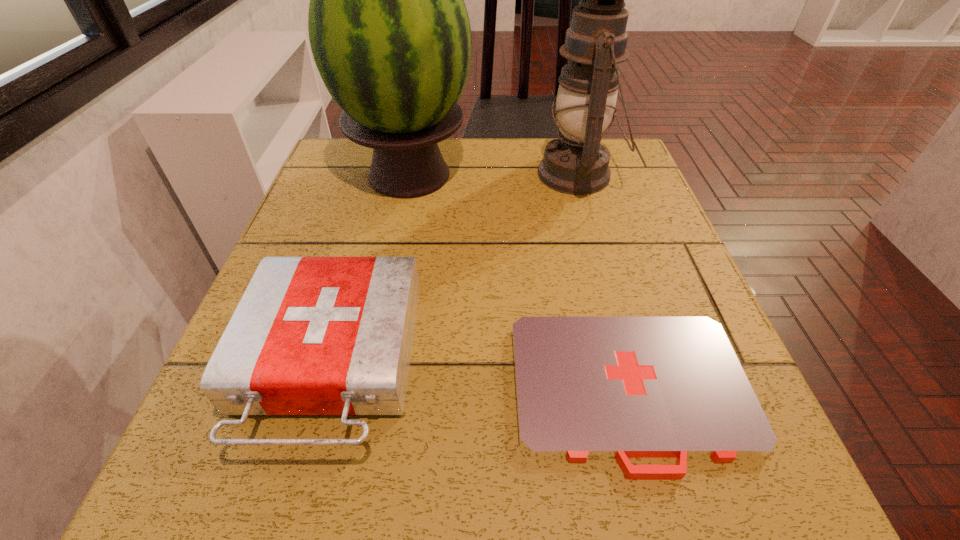
The image size is (960, 540). I want to click on watermelon that is positioned at the left edge, so click(389, 31).

Locate an element on the screen. Image resolution: width=960 pixels, height=540 pixels. the first-aid kit that is at the left edge is located at coordinates (311, 335).

At what (x,y) coordinates should I click in order to perform the action: click on oil lamp that is at the right edge. Please return your answer as a coordinate pair (x, y). The image size is (960, 540). Looking at the image, I should click on (577, 163).

Identify the location of the first-aid kit located at the right edge. The width and height of the screenshot is (960, 540). (586, 387).

Locate an element on the screen. object situated at the far left corner is located at coordinates (389, 31).

Locate an element on the screen. This screenshot has height=540, width=960. object present at the near left corner is located at coordinates (311, 335).

The width and height of the screenshot is (960, 540). I want to click on object present at the far right corner, so click(577, 163).

In order to click on object located at the near right corner in this screenshot , I will do `click(586, 387)`.

I want to click on free space at the far edge of the desktop, so click(x=521, y=145).

You are a GUI agent. You are given a task and a screenshot of the screen. Output one action in this format:
    pyautogui.click(x=<x>, y=<y>)
    Task: Click on the free space at the near edge of the desktop
    Image resolution: width=960 pixels, height=540 pixels.
    Given the screenshot: What is the action you would take?
    pyautogui.click(x=385, y=500)